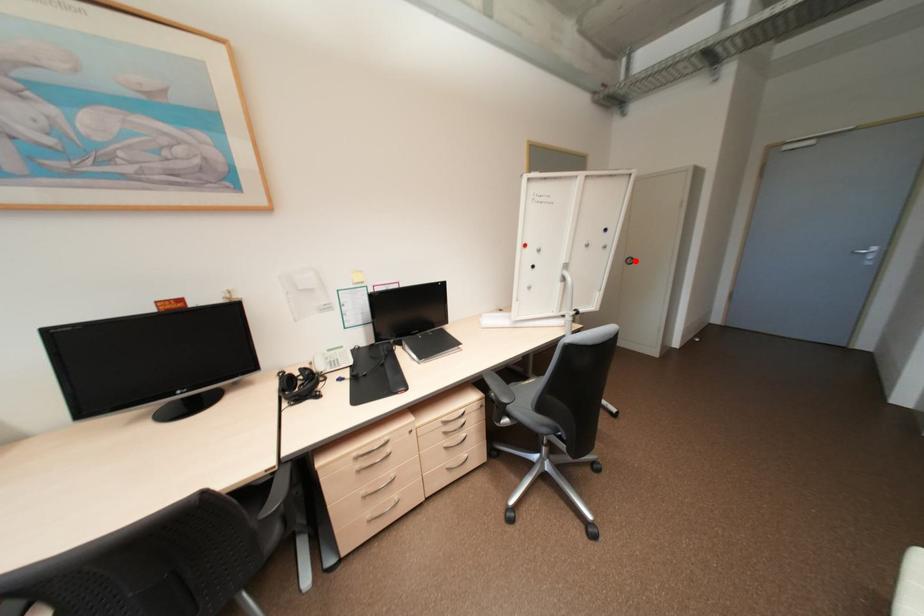
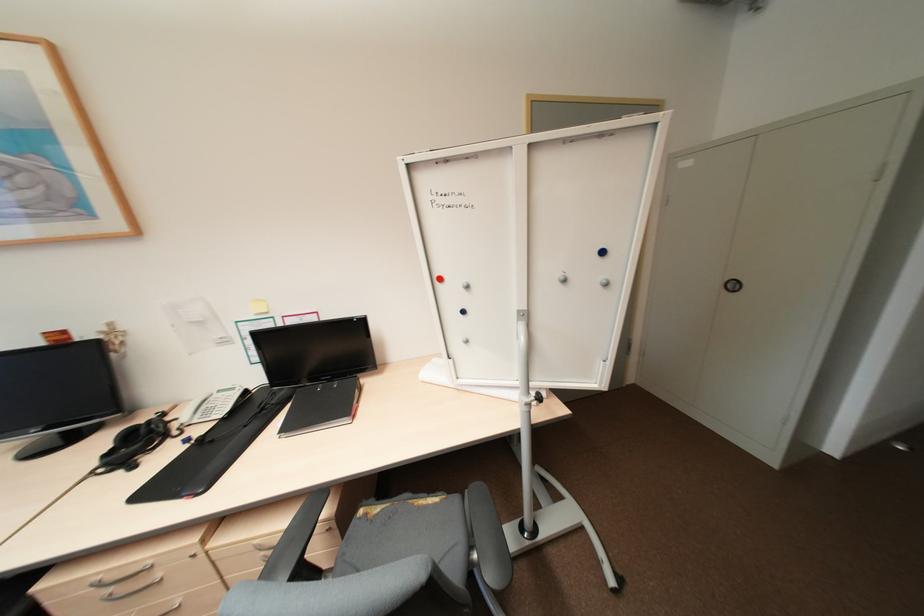
Where in the second image is the point corresponding to the highlighted location from the first image?

(738, 286)